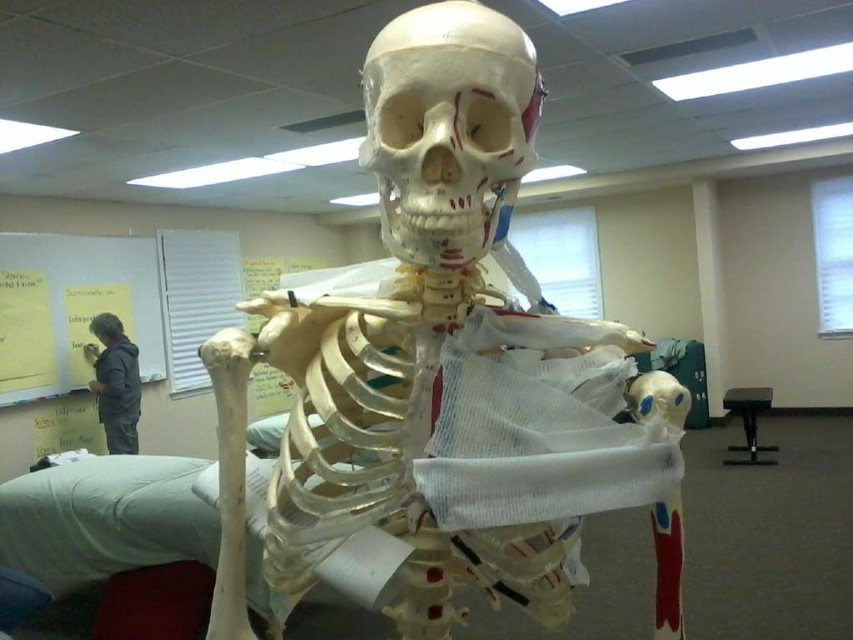
Does white matte skull at center come behind dark gray jacket at upper left?

That is False.

Which is below, white matte skull at center or dark gray jacket at upper left?

dark gray jacket at upper left is below.

Image resolution: width=853 pixels, height=640 pixels. I want to click on white matte skull at center, so click(448, 129).

Can you confirm if white matte skull at center is shorter than white paperboard at upper left?

Indeed, white matte skull at center has a lesser height compared to white paperboard at upper left.

Can you confirm if white matte skull at center is positioned to the right of white paperboard at upper left?

Yes, white matte skull at center is to the right of white paperboard at upper left.

Is point (421, 104) positioned behind point (9, 264)?

That is False.

Where is `white matte skull at center`? white matte skull at center is located at coordinates pyautogui.click(x=448, y=129).

Who is more distant from viewer, (68, 282) or (111, 412)?

The point (68, 282) is more distant.

Can you confirm if white paperboard at upper left is shorter than dark gray jacket at upper left?

No.

Between point (67, 298) and point (109, 353), which one is positioned behind?

The point (67, 298) is behind.

You are a GUI agent. You are given a task and a screenshot of the screen. Output one action in this format:
    pyautogui.click(x=<x>, y=<y>)
    Task: Click on the white paperboard at upper left
    This screenshot has height=640, width=853.
    Given the screenshot: What is the action you would take?
    pyautogui.click(x=71, y=308)